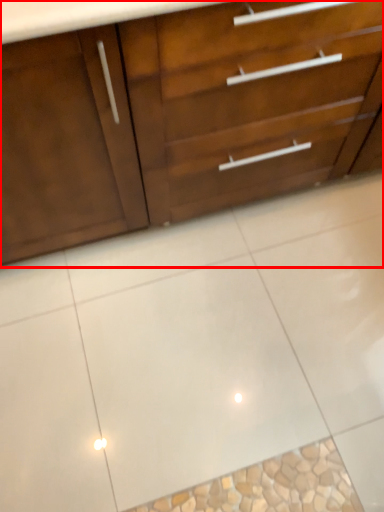
Question: Considering the relative positions of chest of drawers (annotated by the red box) and ceramic tile in the image provided, where is chest of drawers (annotated by the red box) located with respect to the staircase?

Choices:
 (A) left
 (B) right

Answer: (A)